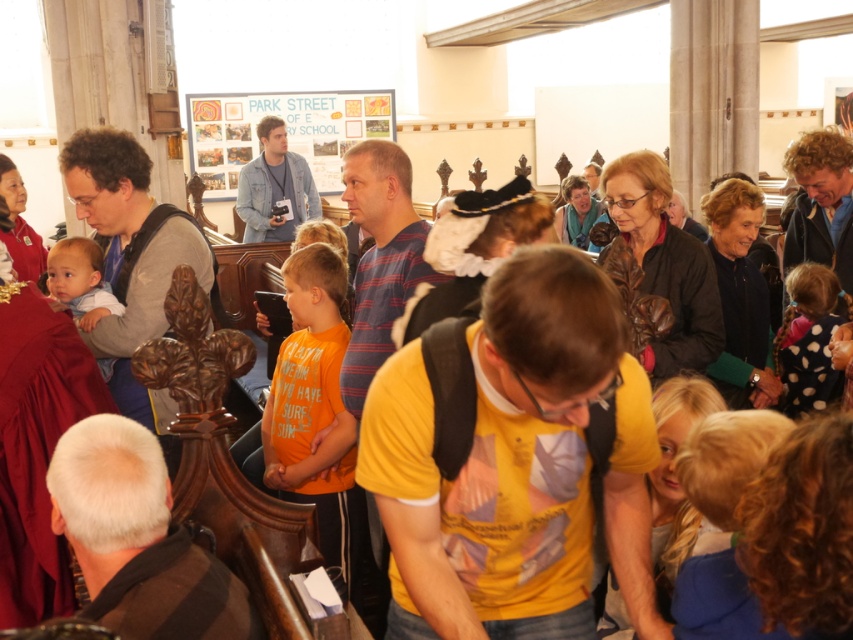
Question: Which object appears farthest from the camera in this image?

Choices:
 (A) orange cotton shirt at center
 (B) polka dot dress at right

Answer: (B)

Question: Considering the relative positions of orange cotton shirt at center and polka dot dress at right in the image provided, where is orange cotton shirt at center located with respect to polka dot dress at right?

Choices:
 (A) right
 (B) left

Answer: (B)

Question: Can you confirm if orange cotton shirt at center is positioned below polka dot dress at right?

Choices:
 (A) no
 (B) yes

Answer: (B)

Question: Which point is closer to the camera taking this photo?

Choices:
 (A) pos(267,438)
 (B) pos(821,276)
 (C) pos(59,266)

Answer: (C)

Question: Which point is closer to the camera taking this photo?

Choices:
 (A) pos(62,259)
 (B) pos(271,412)
 (C) pos(820,408)

Answer: (A)

Question: Observing the image, what is the correct spatial positioning of polka dot dress at right in reference to light blue fabric at left?

Choices:
 (A) left
 (B) right

Answer: (B)